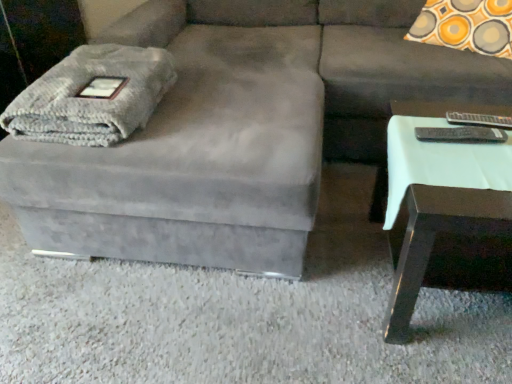
Question: Is white glossy side table at right next to orange-yellow circle-patterned pillow at upper right?

Choices:
 (A) yes
 (B) no

Answer: (B)

Question: Is white glossy side table at right turned away from orange-yellow circle-patterned pillow at upper right?

Choices:
 (A) no
 (B) yes

Answer: (B)

Question: Does white glossy side table at right come in front of orange-yellow circle-patterned pillow at upper right?

Choices:
 (A) no
 (B) yes

Answer: (B)

Question: Is white glossy side table at right further to the viewer compared to orange-yellow circle-patterned pillow at upper right?

Choices:
 (A) no
 (B) yes

Answer: (A)

Question: Does white glossy side table at right have a greater height compared to orange-yellow circle-patterned pillow at upper right?

Choices:
 (A) yes
 (B) no

Answer: (B)

Question: Relative to orange-yellow circle-patterned pillow at upper right, is suede gray couch at center in front or behind?

Choices:
 (A) front
 (B) behind

Answer: (A)

Question: From a real-world perspective, is suede gray couch at center positioned above or below orange-yellow circle-patterned pillow at upper right?

Choices:
 (A) below
 (B) above

Answer: (A)

Question: From their relative heights in the image, would you say suede gray couch at center is taller or shorter than orange-yellow circle-patterned pillow at upper right?

Choices:
 (A) short
 (B) tall

Answer: (B)

Question: Looking at their shapes, would you say suede gray couch at center is wider or thinner than orange-yellow circle-patterned pillow at upper right?

Choices:
 (A) wide
 (B) thin

Answer: (A)

Question: Is gray knitted blanket at left inside the boundaries of white glossy side table at right, or outside?

Choices:
 (A) outside
 (B) inside

Answer: (A)

Question: Considering the positions of gray knitted blanket at left and white glossy side table at right in the image, is gray knitted blanket at left taller or shorter than white glossy side table at right?

Choices:
 (A) short
 (B) tall

Answer: (A)

Question: Is gray knitted blanket at left wider or thinner than white glossy side table at right?

Choices:
 (A) wide
 (B) thin

Answer: (A)

Question: Relative to white glossy side table at right, is gray knitted blanket at left in front or behind?

Choices:
 (A) front
 (B) behind

Answer: (B)

Question: Considering the positions of orange-yellow circle-patterned pillow at upper right and white glossy side table at right in the image, is orange-yellow circle-patterned pillow at upper right wider or thinner than white glossy side table at right?

Choices:
 (A) wide
 (B) thin

Answer: (A)

Question: Relative to white glossy side table at right, is orange-yellow circle-patterned pillow at upper right in front or behind?

Choices:
 (A) front
 (B) behind

Answer: (B)